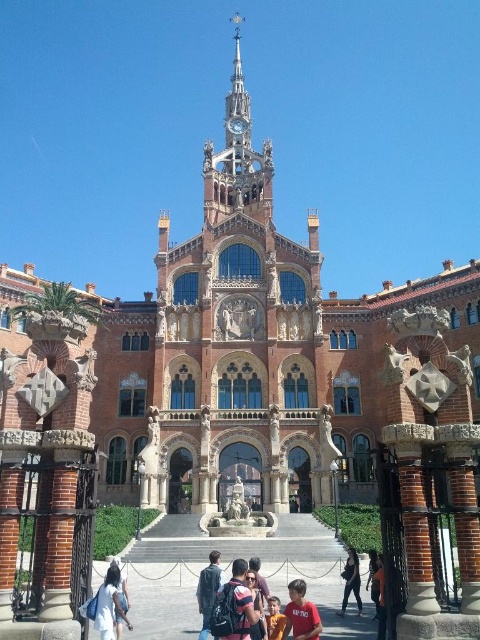
Is white cotton dress at lower left smaller than red shirt at lower center?

Yes, white cotton dress at lower left is smaller than red shirt at lower center.

Between point (113, 632) and point (305, 634), which one is positioned behind?

Point (113, 632)

Is point (107, 627) in front of point (295, 595)?

Yes, point (107, 627) is in front of point (295, 595).

At what (x,y) coordinates should I click in order to perform the action: click on white cotton dress at lower left. Please return your answer as a coordinate pair (x, y). Image resolution: width=480 pixels, height=640 pixels. Looking at the image, I should click on (109, 604).

Between white cotton dress at lower left and striped fabric backpack at center, which one appears on the right side from the viewer's perspective?

Positioned to the right is striped fabric backpack at center.

Does white cotton dress at lower left have a greater width compared to striped fabric backpack at center?

Indeed, white cotton dress at lower left has a greater width compared to striped fabric backpack at center.

Locate an element on the screen. This screenshot has height=640, width=480. white cotton dress at lower left is located at coordinates (109, 604).

Does point (214, 624) come behind point (343, 611)?

No, (214, 624) is in front of (343, 611).

Is point (230, 625) positioned in front of point (354, 564)?

Yes.

Find the location of a particular element. Image resolution: width=480 pixels, height=640 pixels. matte black backpack at center is located at coordinates (235, 605).